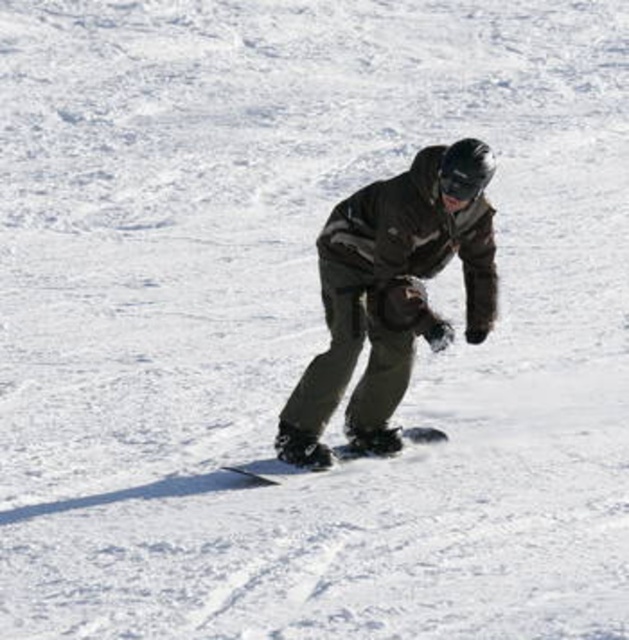
You are a photographer trying to capture a closeup of the black matte snowboard at center and the black matte goggles at center. Since you want to focus on both objects equally, which one should you zoom in on more to ensure they appear the same size in the photo?

The black matte snowboard at center is larger than the black matte goggles at center. To make them appear the same size in the photo, you should zoom in more on the black matte goggles at center because it is smaller and needs to be magnified to match the size of the snowboard.

You are a photographer standing at the camera position. You want to capture a closeup shot of the black matte snowboard at center. Given that your camera has a minimum focusing distance of 10 meters, will you be able to take the photo without moving closer?

The black matte snowboard at center and camera are 9.49 meters apart from each other, which is less than the camera minimum focusing distance of 10 meters. Therefore, you won the be able to take the photo without moving closer.